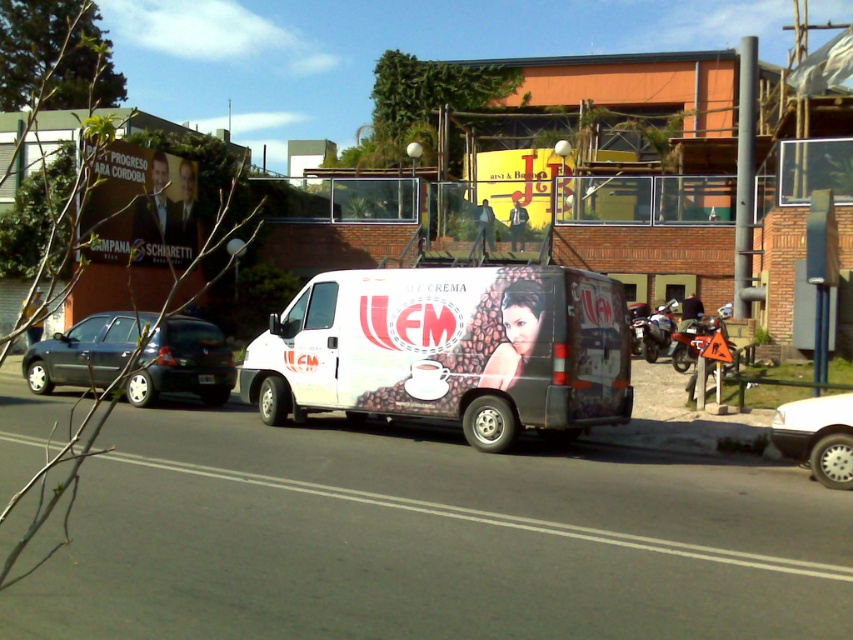
Between white matte van at center and metallic silver motorcycle at center-right, which one has more height?

With more height is white matte van at center.

Does white matte van at center have a smaller size compared to metallic silver motorcycle at center-right?

Incorrect, white matte van at center is not smaller in size than metallic silver motorcycle at center-right.

The height and width of the screenshot is (640, 853). Describe the element at coordinates (450, 349) in the screenshot. I see `white matte van at center` at that location.

Locate an element on the screen. white matte van at center is located at coordinates (450, 349).

Can you confirm if white matte car at lower right is positioned above metallic silver motorcycle at center-right?

No.

Which is in front, point (838, 468) or point (647, 316)?

Point (838, 468) is more forward.

The width and height of the screenshot is (853, 640). In order to click on white matte car at lower right in this screenshot , I will do `click(817, 436)`.

Is white matte car at lower right to the right of metallic silver motorcycle at center from the viewer's perspective?

No, white matte car at lower right is not to the right of metallic silver motorcycle at center.

Who is more forward, (833, 438) or (686, 362)?

Positioned in front is point (833, 438).

The image size is (853, 640). In order to click on white matte car at lower right in this screenshot , I will do (x=817, y=436).

Locate an element on the screen. Image resolution: width=853 pixels, height=640 pixels. white matte car at lower right is located at coordinates (817, 436).